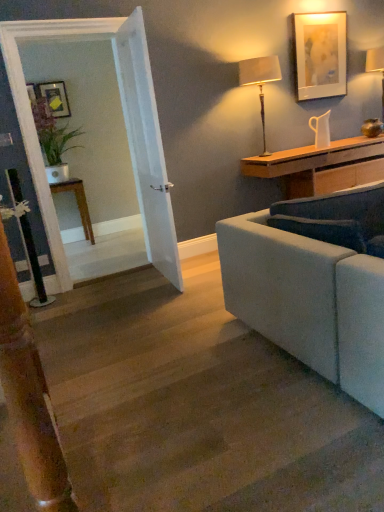
Question: Would you say wooden desk at right is to the left or to the right of matte beige lampshade at upper right, which ranks as the 1th lamp in front-to-back order, in the picture?

Choices:
 (A) left
 (B) right

Answer: (B)

Question: Do you think wooden desk at right is within matte beige lampshade at upper right, the 1th lamp viewed from the left, or outside of it?

Choices:
 (A) outside
 (B) inside

Answer: (A)

Question: Based on their relative distances, which object is nearer to the green leafy plant in pot at left?

Choices:
 (A) matte black picture frame at upper left, marked as the second picture frame in a front-to-back arrangement
 (B) clear glass door at left
 (C) matte gold vase at upper right, the 2th lamp when ordered from left to right
 (D) wooden desk at right
 (E) matte beige lampshade at upper right, which ranks as the 1th lamp in front-to-back order

Answer: (A)

Question: Which object is the closest to the matte gold vase at upper right, the 2th lamp when ordered from left to right?

Choices:
 (A) matte white picture frame at upper right, which is the 1th picture frame in right-to-left order
 (B) matte beige lampshade at upper right, the second lamp in the right-to-left sequence
 (C) wooden desk at right
 (D) wooden stairs at lower left
 (E) matte black picture frame at upper left, which ranks as the 1th picture frame in back-to-front order

Answer: (A)